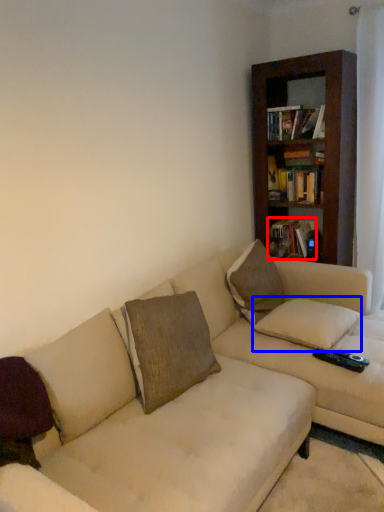
Question: Which object appears farthest to the camera in this image, book (highlighted by a red box) or pillow (highlighted by a blue box)?

Choices:
 (A) book
 (B) pillow

Answer: (A)